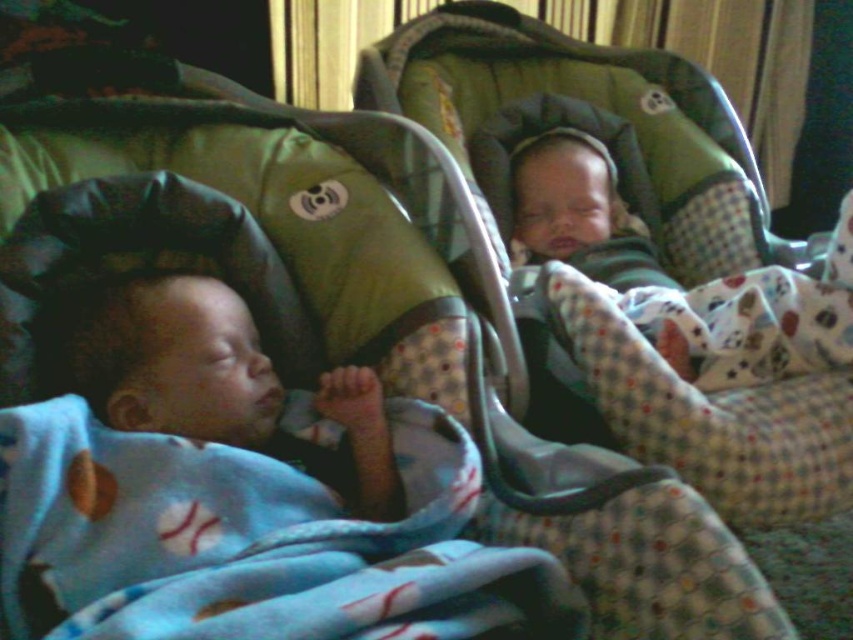
Question: Which object is farther from the camera taking this photo?

Choices:
 (A) blue fleece blanket at lower left
 (B) soft blue blanket at left

Answer: (B)

Question: Which point is farther to the camera?

Choices:
 (A) (94, 390)
 (B) (444, 572)

Answer: (A)

Question: Is blue fleece blanket at lower left smaller than soft blue blanket at left?

Choices:
 (A) no
 (B) yes

Answer: (A)

Question: Is blue fleece blanket at lower left smaller than soft blue blanket at left?

Choices:
 (A) yes
 (B) no

Answer: (B)

Question: Is blue fleece blanket at lower left smaller than soft blue blanket at left?

Choices:
 (A) no
 (B) yes

Answer: (A)